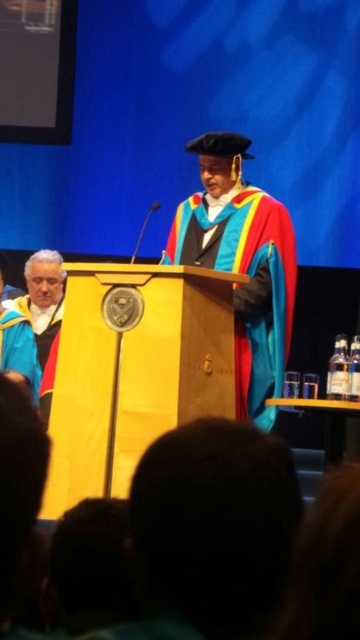
Question: Can you confirm if velvet-like multicolored graduation gown at center is thinner than blue velvet robe at left?

Choices:
 (A) no
 (B) yes

Answer: (A)

Question: Does velvet-like multicolored graduation gown at center appear on the right side of blue velvet robe at left?

Choices:
 (A) no
 (B) yes

Answer: (B)

Question: Does velvet-like multicolored graduation gown at center appear under blue velvet robe at left?

Choices:
 (A) no
 (B) yes

Answer: (A)

Question: Which object appears closest to the camera in this image?

Choices:
 (A) velvet-like multicolored graduation gown at center
 (B) blue velvet robe at left

Answer: (A)